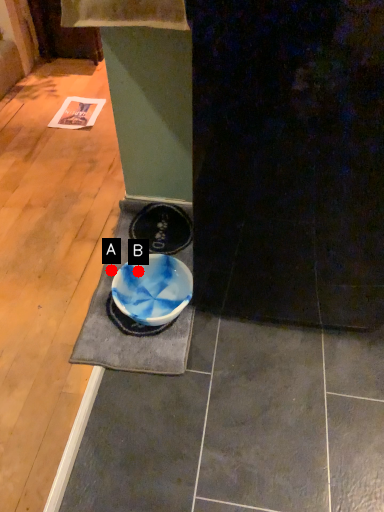
Question: Two points are circled on the image, labeled by A and B beside each circle. Which point is farther to the camera?

Choices:
 (A) A is further
 (B) B is further

Answer: (A)